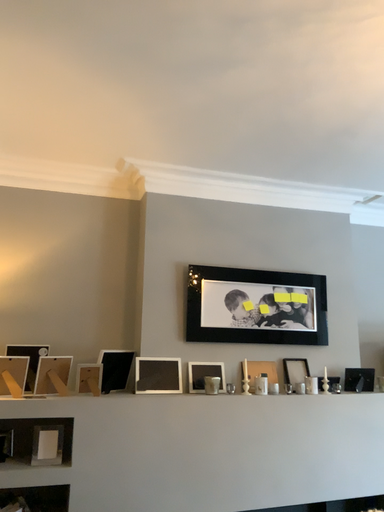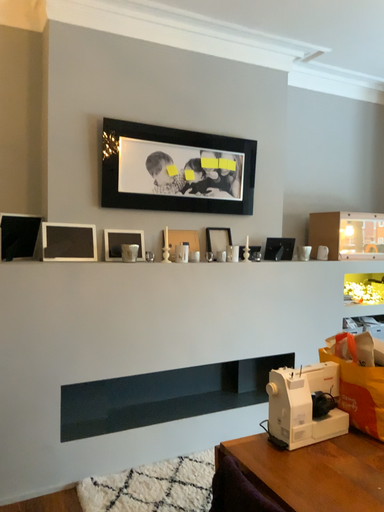
Question: Which way did the camera rotate in the video?

Choices:
 (A) rotated right
 (B) rotated left

Answer: (A)